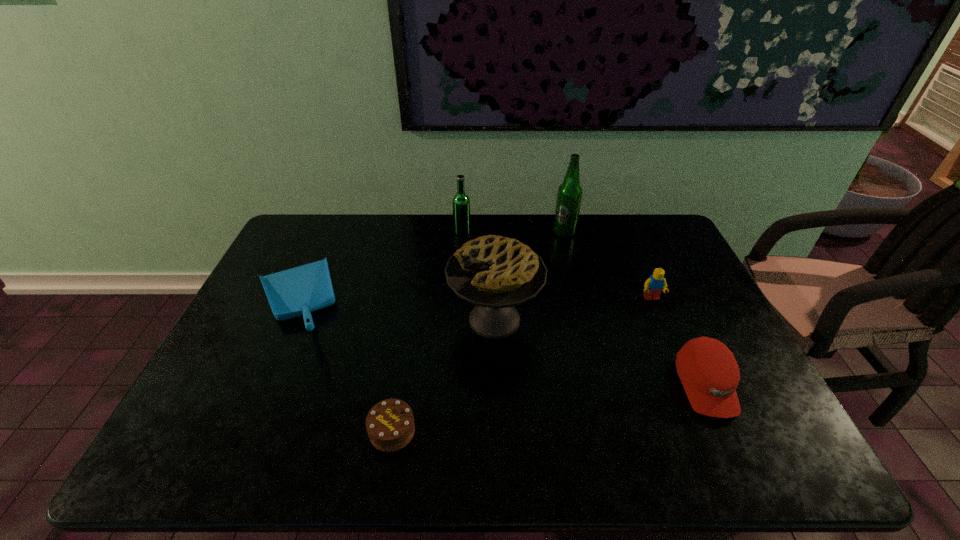
Identify the location of Lego that is positioned at the right edge. (653, 286).

The image size is (960, 540). I want to click on cap present at the right edge, so click(708, 370).

Where is `free region at the far edge`? Image resolution: width=960 pixels, height=540 pixels. free region at the far edge is located at coordinates (579, 232).

Identify the location of vacant area at the left edge of the desktop. (269, 377).

This screenshot has height=540, width=960. In order to click on free space at the right edge of the desktop in this screenshot , I will do `click(704, 289)`.

This screenshot has height=540, width=960. What are the coordinates of `free space between the cap and the shortest object` in the screenshot? It's located at (549, 408).

Where is `vacant area that lies between the Lego and the chocolate cake`? This screenshot has width=960, height=540. vacant area that lies between the Lego and the chocolate cake is located at coordinates (522, 365).

Identify the location of empty location between the left beer bottle and the cap. This screenshot has width=960, height=540. (584, 309).

Locate an element on the screen. The height and width of the screenshot is (540, 960). vacant space in between the sixth object from right to left and the Lego is located at coordinates (522, 365).

Locate an element on the screen. The width and height of the screenshot is (960, 540). vacant space that is in between the dustpan and the shorter beer bottle is located at coordinates (378, 268).